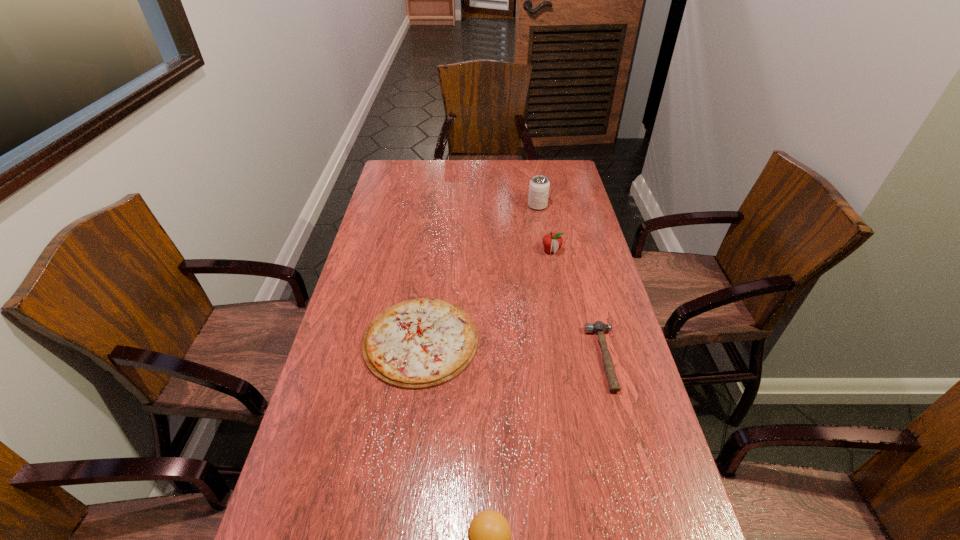
Identify the location of free space between the tallest object and the fourth nearest object. The width and height of the screenshot is (960, 540). (544, 228).

I want to click on free spot between the apple and the farthest object, so click(x=544, y=228).

Locate an element on the screen. free space between the fourth nearest object and the soda can is located at coordinates (544, 228).

Find the location of a particular element. This screenshot has height=540, width=960. free spot between the second farthest object and the second shortest object is located at coordinates (578, 305).

Where is `free spot between the shortest object and the soda can`? free spot between the shortest object and the soda can is located at coordinates (479, 273).

At what (x,y) coordinates should I click in order to perform the action: click on free space between the fourth tallest object and the apple. Please return your answer as a coordinate pair (x, y). The height and width of the screenshot is (540, 960). Looking at the image, I should click on (578, 305).

Find the location of a particular element. free spot between the rightmost object and the farthest object is located at coordinates (571, 282).

Identify which object is the second nearest to the farthest object. Please provide its 2D coordinates. Your answer should be formatted as a tuple, i.e. [(x, y)], where the tuple contains the x and y coordinates of a point satisfying the conditions above.

[(420, 343)]

Select which object is the third closest to the farthest object. Please provide its 2D coordinates. Your answer should be formatted as a tuple, i.e. [(x, y)], where the tuple contains the x and y coordinates of a point satisfying the conditions above.

[(598, 327)]

Find the location of a particular element. vacant space that satisfies the following two spatial constraints: 1. on the front side of the soda can; 2. on the right side of the apple is located at coordinates (545, 251).